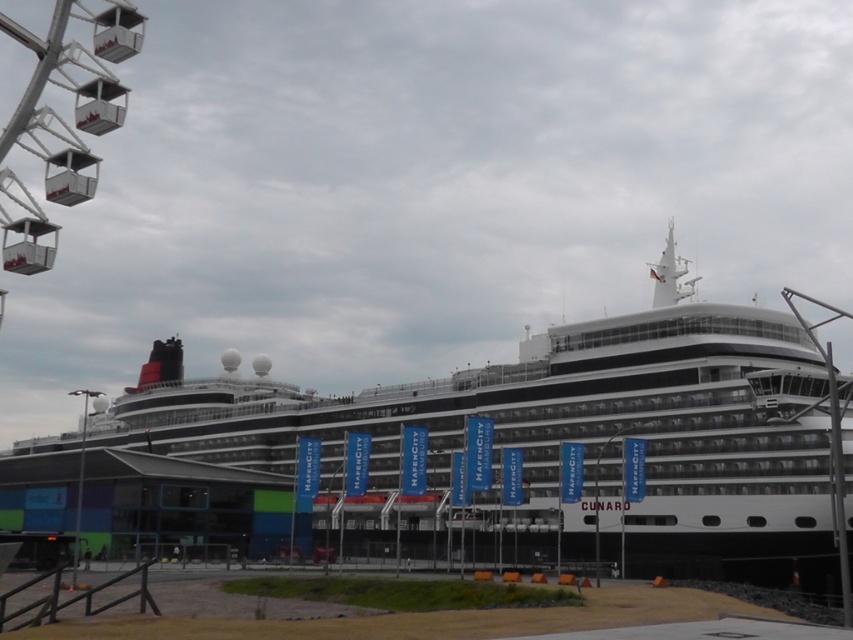
Question: Which point is farther to the camera?

Choices:
 (A) white glossy cruise ship at center
 (B) metallic silver ferris wheel at upper left

Answer: (A)

Question: Is white glossy cruise ship at center to the left of metallic silver ferris wheel at upper left from the viewer's perspective?

Choices:
 (A) yes
 (B) no

Answer: (B)

Question: Is white glossy cruise ship at center positioned before metallic silver ferris wheel at upper left?

Choices:
 (A) no
 (B) yes

Answer: (A)

Question: Which object is closer to the camera taking this photo?

Choices:
 (A) metallic silver ferris wheel at upper left
 (B) white glossy cruise ship at center

Answer: (A)

Question: Is white glossy cruise ship at center behind metallic silver ferris wheel at upper left?

Choices:
 (A) yes
 (B) no

Answer: (A)